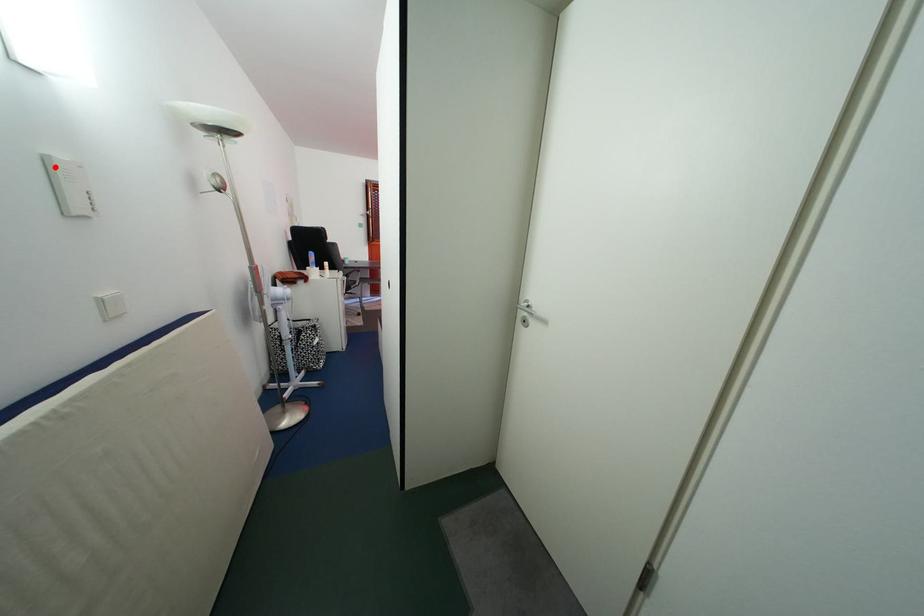
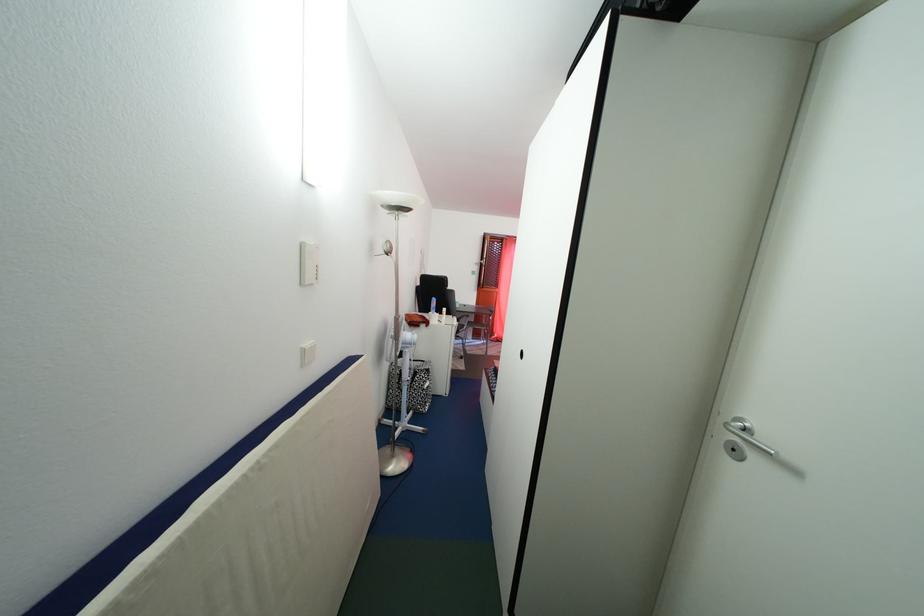
Where in the second image is the point corresponding to the highlighted location from the first image?

(310, 253)